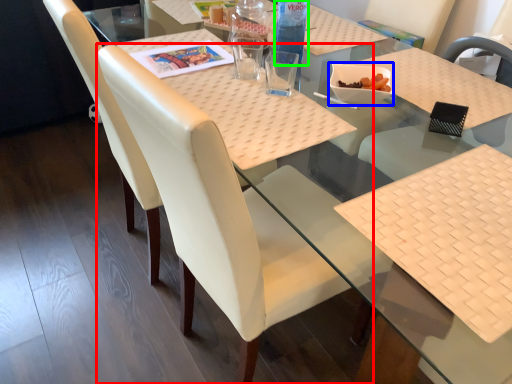
Question: Which object is the closest to the chair (highlighted by a red box)? Choose among these: food (highlighted by a blue box) or bottle (highlighted by a green box).

Choices:
 (A) food
 (B) bottle

Answer: (A)